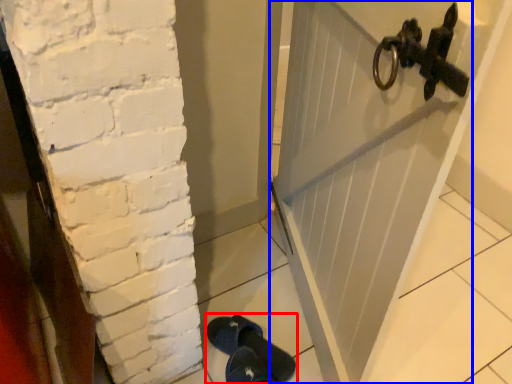
Question: Which point is further to the camera, footwear (highlighted by a red box) or door (highlighted by a blue box)?

Choices:
 (A) footwear
 (B) door

Answer: (B)